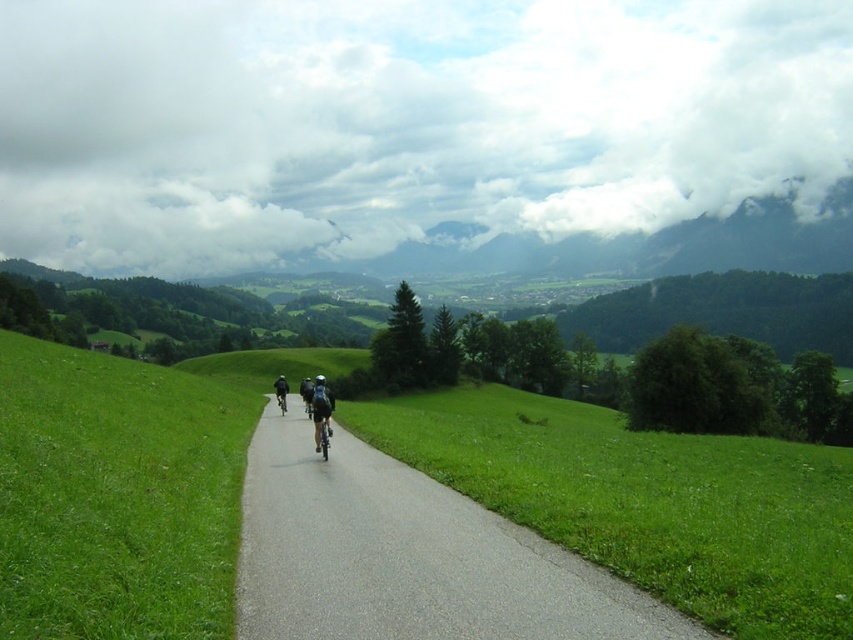
Can you confirm if green grassy at center is bigger than black matte bicycle at center?

Correct, green grassy at center is larger in size than black matte bicycle at center.

Which of these two, green grassy at center or black matte bicycle at center, stands shorter?

Standing shorter between the two is black matte bicycle at center.

This screenshot has height=640, width=853. Describe the element at coordinates (648, 500) in the screenshot. I see `green grassy at center` at that location.

This screenshot has height=640, width=853. I want to click on green grassy at center, so coord(648,500).

From the picture: Who is lower down, dark blue helmet at center or black matte bicycle at center?

black matte bicycle at center is lower down.

In the scene shown: Who is more distant from viewer, (318,387) or (310,387)?

Positioned behind is point (310,387).

This screenshot has height=640, width=853. Describe the element at coordinates (320, 408) in the screenshot. I see `dark blue helmet at center` at that location.

Locate an element on the screen. The width and height of the screenshot is (853, 640). dark blue helmet at center is located at coordinates (320, 408).

Can you confirm if gray asphalt road at center is smaller than dark blue fabric cyclist at center?

Yes.

Where is `gray asphalt road at center`? This screenshot has height=640, width=853. gray asphalt road at center is located at coordinates (408, 556).

Is point (561, 627) positioned behind point (285, 392)?

No.

Image resolution: width=853 pixels, height=640 pixels. In order to click on gray asphalt road at center in this screenshot , I will do `click(408, 556)`.